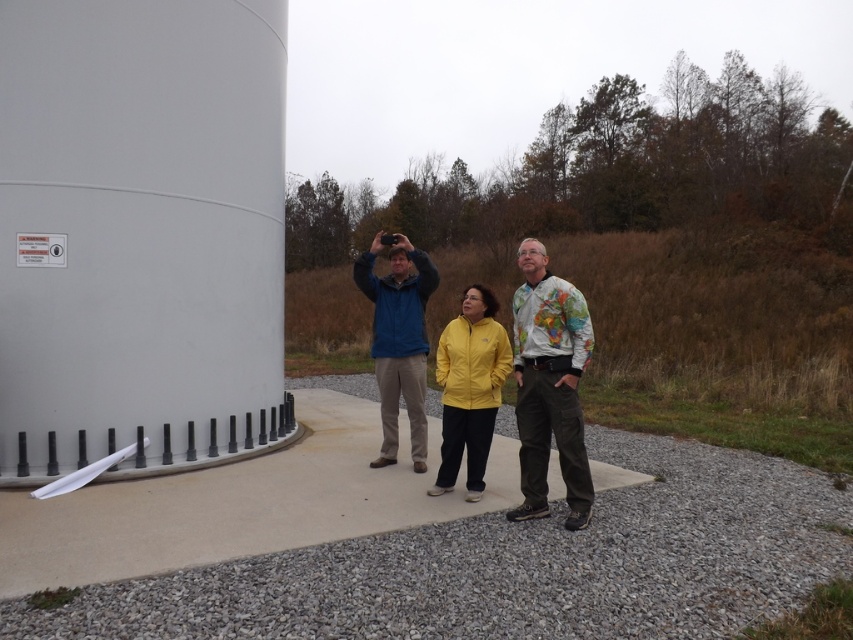
You are standing on the concrete platform near the large white cylinder. You need to locate the yellow fabric jacket at center. Where exactly is it positioned relative to the cylinder?

The yellow fabric jacket at center is located at point 0.603 on the x axis and 0.645 on the y axis relative to the cylinder.